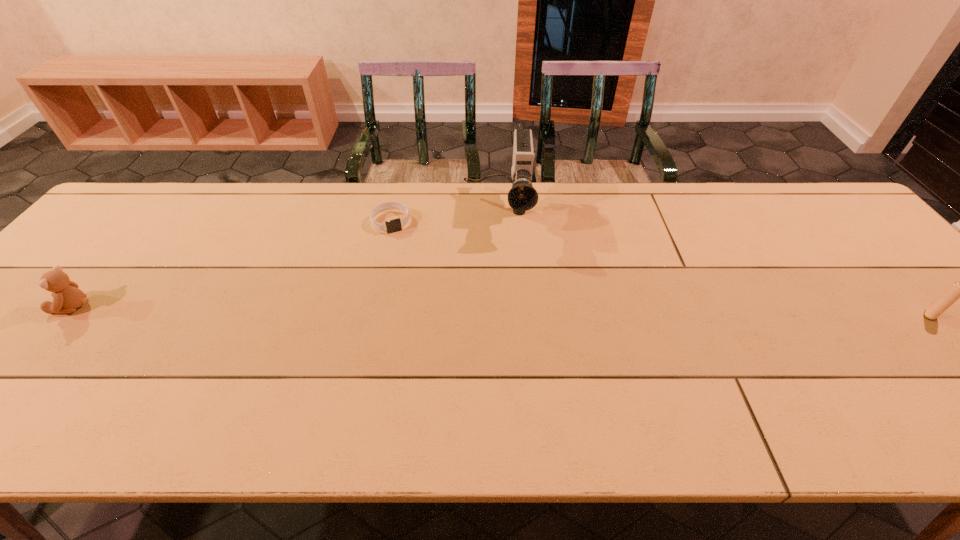
At what (x,y) coordinates should I click in order to perform the action: click on free space on the desktop that is between the teddy bear and the igniter and is positioned on the recording direction of the tallest object. Please return your answer as a coordinate pair (x, y). The width and height of the screenshot is (960, 540). Looking at the image, I should click on click(494, 310).

At what (x,y) coordinates should I click in order to perform the action: click on vacant space on the desktop that is between the teddy bear and the igniter and is positioned on the outer surface of the wristband. Please return your answer as a coordinate pair (x, y). The height and width of the screenshot is (540, 960). Looking at the image, I should click on (429, 309).